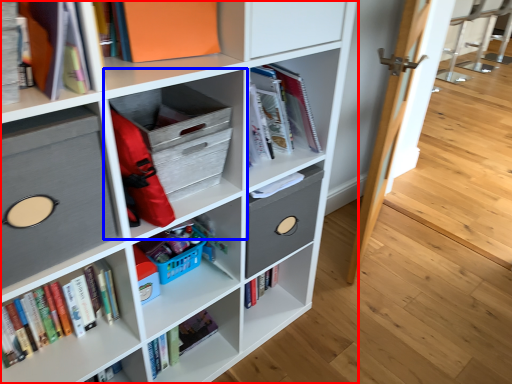
Question: Which object appears farthest to the camera in this image, shelf (highlighted by a red box) or shelf (highlighted by a blue box)?

Choices:
 (A) shelf
 (B) shelf

Answer: (B)